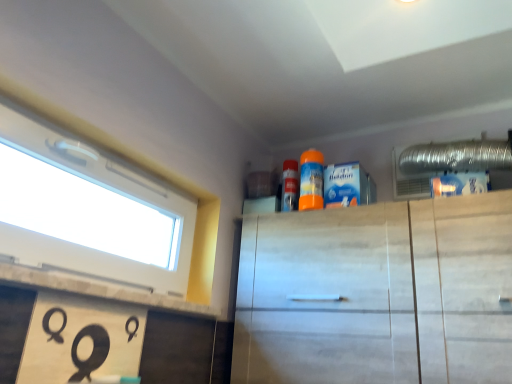
Question: Is white marble cabinet at upper center shorter than white plastic window at upper left?

Choices:
 (A) no
 (B) yes

Answer: (A)

Question: Does white marble cabinet at upper center lie behind white plastic window at upper left?

Choices:
 (A) no
 (B) yes

Answer: (B)

Question: Does white marble cabinet at upper center turn towards white plastic window at upper left?

Choices:
 (A) no
 (B) yes

Answer: (B)

Question: Considering the relative positions of white marble cabinet at upper center and white plastic window at upper left in the image provided, is white marble cabinet at upper center to the right of white plastic window at upper left from the viewer's perspective?

Choices:
 (A) no
 (B) yes

Answer: (B)

Question: Does white marble cabinet at upper center have a lesser width compared to white plastic window at upper left?

Choices:
 (A) no
 (B) yes

Answer: (A)

Question: In the image, is white marble cabinet at upper center positioned in front of or behind white plastic window at upper left?

Choices:
 (A) behind
 (B) front

Answer: (A)

Question: In terms of size, does white marble cabinet at upper center appear bigger or smaller than white plastic window at upper left?

Choices:
 (A) small
 (B) big

Answer: (B)

Question: In terms of height, does white marble cabinet at upper center look taller or shorter compared to white plastic window at upper left?

Choices:
 (A) short
 (B) tall

Answer: (B)

Question: In terms of width, does white marble cabinet at upper center look wider or thinner when compared to white plastic window at upper left?

Choices:
 (A) thin
 (B) wide

Answer: (B)

Question: From the image's perspective, is white plastic window at upper left positioned above or below orange matte spray can at upper center?

Choices:
 (A) above
 (B) below

Answer: (B)

Question: Looking at the image, does white plastic window at upper left seem bigger or smaller compared to orange matte spray can at upper center?

Choices:
 (A) small
 (B) big

Answer: (B)

Question: From a real-world perspective, is white plastic window at upper left above or below orange matte spray can at upper center?

Choices:
 (A) below
 (B) above

Answer: (A)

Question: Considering the relative positions of white plastic window at upper left and orange matte spray can at upper center in the image provided, is white plastic window at upper left to the left or to the right of orange matte spray can at upper center?

Choices:
 (A) right
 (B) left

Answer: (B)

Question: Is point (313, 185) closer or farther from the camera than point (489, 324)?

Choices:
 (A) closer
 (B) farther

Answer: (B)

Question: Is orange matte spray can at upper center in front of or behind white marble cabinet at upper center in the image?

Choices:
 (A) behind
 (B) front

Answer: (A)